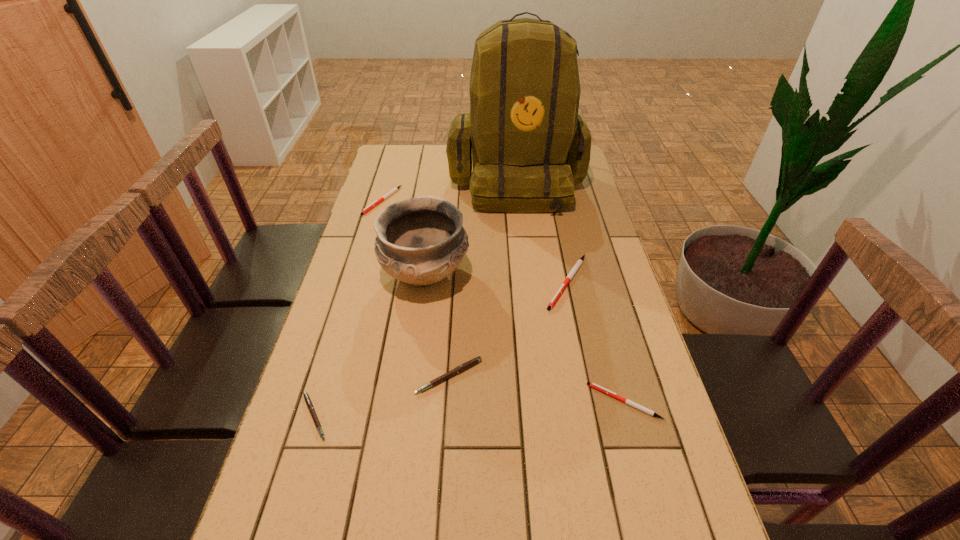
Locate an element on the screen. free spot that satisfies the following two spatial constraints: 1. on the clicker of the farthest pen; 2. on the right side of the pottery is located at coordinates (361, 274).